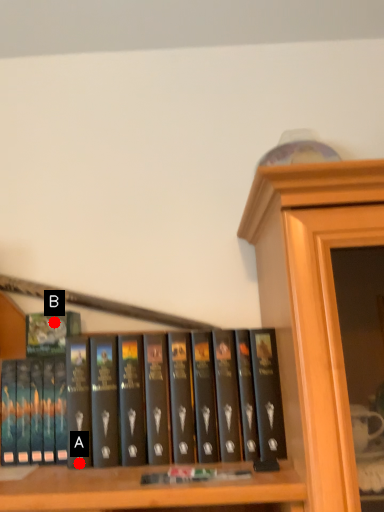
Question: Two points are circled on the image, labeled by A and B beside each circle. Among these points, which one is nearest to the camera?

Choices:
 (A) A is closer
 (B) B is closer

Answer: (A)